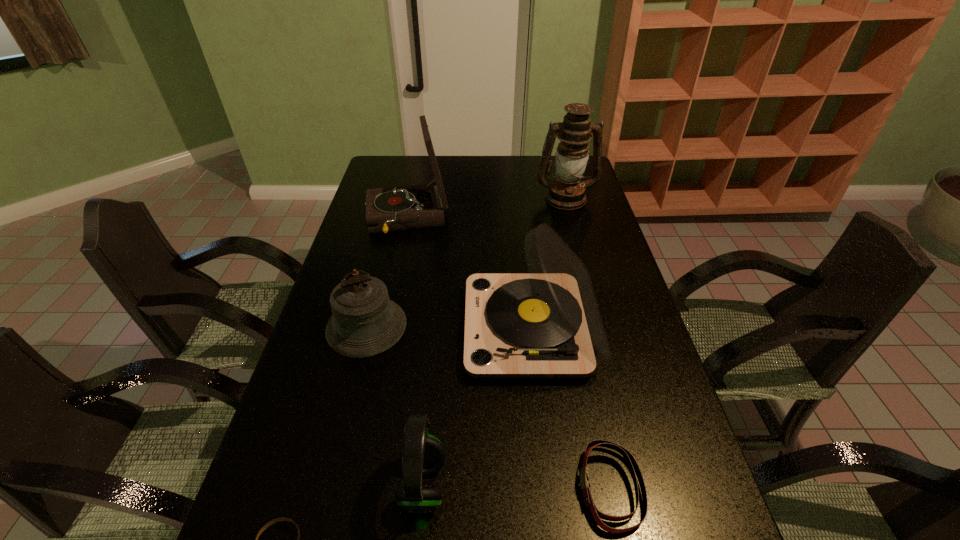
In order to click on vacant space at the left edge of the desktop in this screenshot , I will do `click(404, 184)`.

In the image, there is a desktop. Where is `free space at the right edge`? This screenshot has width=960, height=540. free space at the right edge is located at coordinates (634, 399).

Identify the location of vacant point located between the record player and the headset. (477, 407).

At what (x,y) coordinates should I click in order to perform the action: click on vacant space that is in between the phonograph record and the bell. Please return your answer as a coordinate pair (x, y). Looking at the image, I should click on (387, 273).

In order to click on free space between the record player and the second shortest object in this screenshot , I will do `click(570, 408)`.

At what (x,y) coordinates should I click in order to perform the action: click on empty location between the bell and the lantern. Please return your answer as a coordinate pair (x, y). This screenshot has width=960, height=540. Looking at the image, I should click on (466, 262).

The height and width of the screenshot is (540, 960). Identify the location of free point between the lantern and the phonograph record. (486, 209).

Locate an element on the screen. The width and height of the screenshot is (960, 540). free space between the dog collar and the record player is located at coordinates (570, 408).

Identify which object is the sixth nearest to the lantern. Please provide its 2D coordinates. Your answer should be formatted as a tuple, i.e. [(x, y)], where the tuple contains the x and y coordinates of a point satisfying the conditions above.

[(273, 521)]

At what (x,y) coordinates should I click in order to perform the action: click on the fourth closest object to the headset. Please return your answer as a coordinate pair (x, y). This screenshot has height=540, width=960. Looking at the image, I should click on (631, 462).